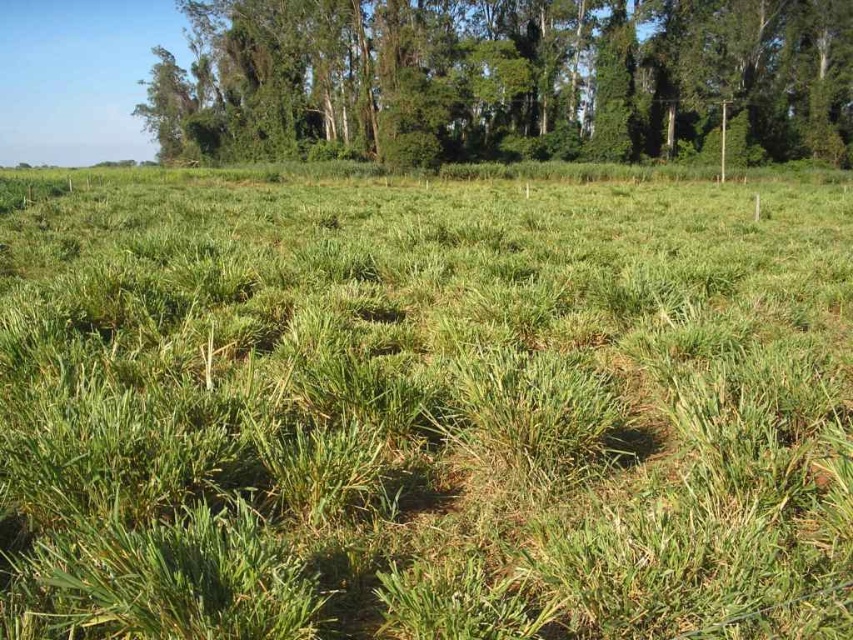
Question: Which point is closer to the camera taking this photo?

Choices:
 (A) (612, 131)
 (B) (822, 428)

Answer: (B)

Question: Is green grassy field at center to the right of green leafy trees at upper center from the viewer's perspective?

Choices:
 (A) yes
 (B) no

Answer: (A)

Question: Which object is closer to the camera taking this photo?

Choices:
 (A) green grassy field at center
 (B) green leafy trees at upper center

Answer: (A)

Question: Can you confirm if green grassy field at center is positioned to the right of green leafy trees at upper center?

Choices:
 (A) no
 (B) yes

Answer: (B)

Question: Can you confirm if green grassy field at center is positioned to the left of green leafy trees at upper center?

Choices:
 (A) no
 (B) yes

Answer: (A)